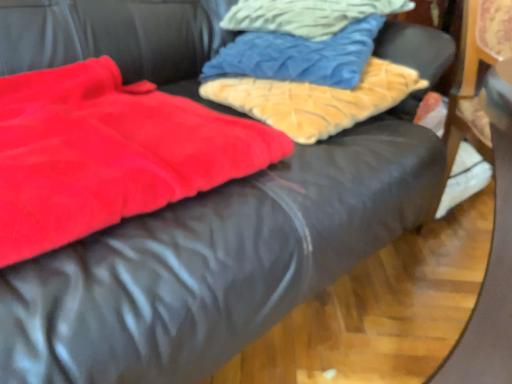
Question: Is velvet blue pillow at upper center, the 2th cloth from the top, taller or shorter than velvety red blanket at left?

Choices:
 (A) short
 (B) tall

Answer: (B)

Question: In terms of size, does velvet blue pillow at upper center, the 2th cloth positioned from the bottom, appear bigger or smaller than velvety red blanket at left?

Choices:
 (A) big
 (B) small

Answer: (A)

Question: Based on their relative distances, which object is farther from the velvet blue pillow at upper center, the 2th cloth positioned from the bottom?

Choices:
 (A) velvet blue pillow at upper center, positioned as the first cloth in top-to-bottom order
 (B) fuzzy beige pillow at upper center, the third cloth from the top
 (C) velvety red blanket at left

Answer: (C)

Question: Which object is positioned closest to the velvety red blanket at left?

Choices:
 (A) velvet blue pillow at upper center, which is the third cloth in bottom-to-top order
 (B) fuzzy beige pillow at upper center, the 1th cloth from the bottom
 (C) velvet blue pillow at upper center, the 2th cloth positioned from the bottom

Answer: (B)